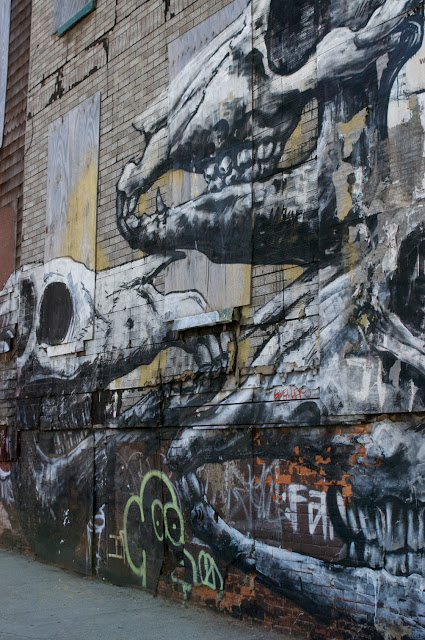
Identify the location of brick wall. This screenshot has height=640, width=425. (294, 534).